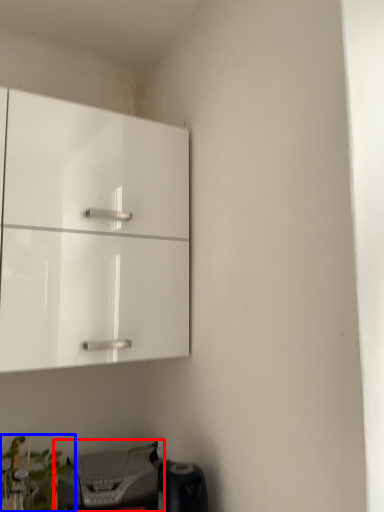
Question: Which object appears closest to the camera in this image, printer (highlighted by a red box) or plant (highlighted by a blue box)?

Choices:
 (A) printer
 (B) plant

Answer: (B)